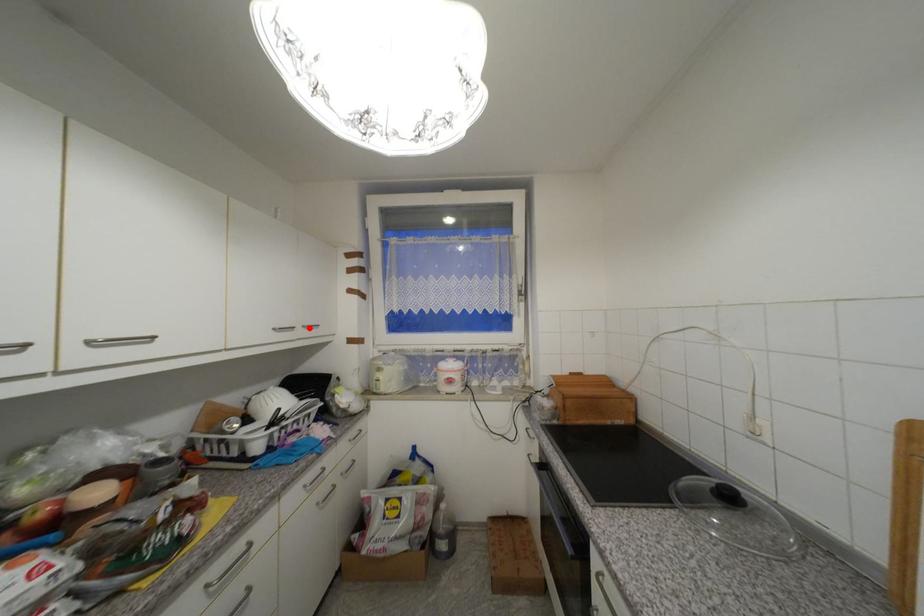
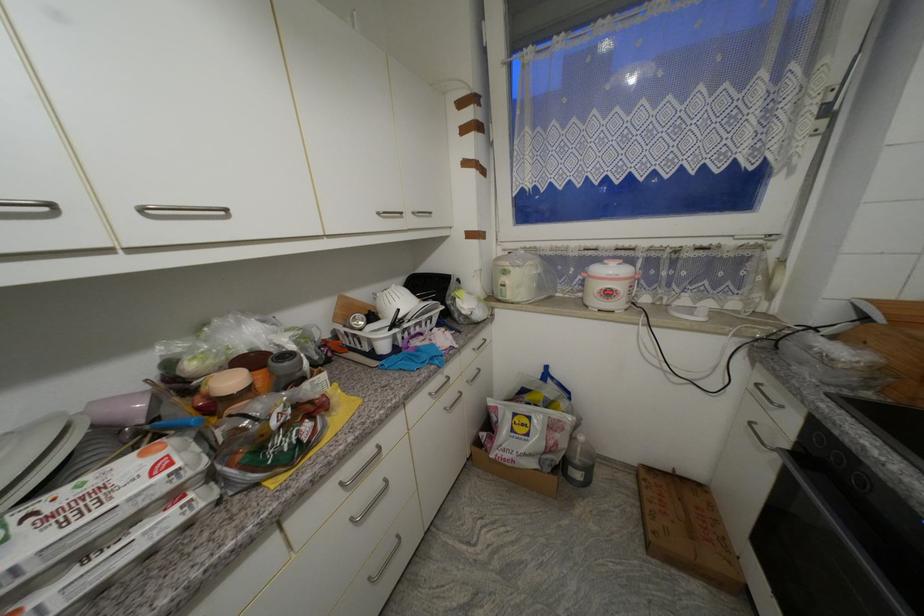
Locate, in the second image, the point that corresponds to the highlighted location in the first image.

(419, 215)